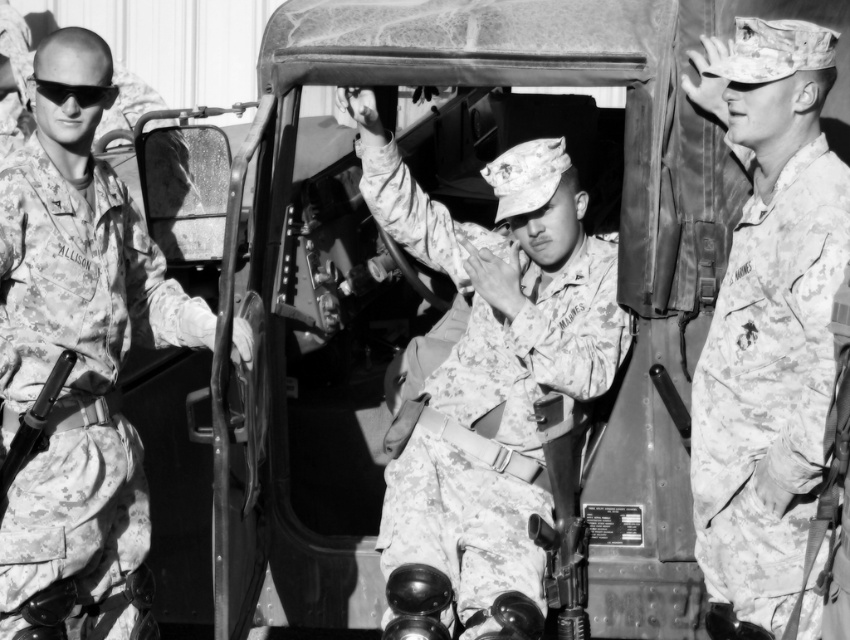
Based on the scene description, what are the coordinates of the camouflage uniform at center?

The camouflage uniform at center is located at coordinates point (491, 360).

Based on the scene described, which soldier, the camouflage uniform at center or the camouflage uniform at left, has a shorter height?

The camouflage uniform at center is shorter than the camouflage uniform at left.